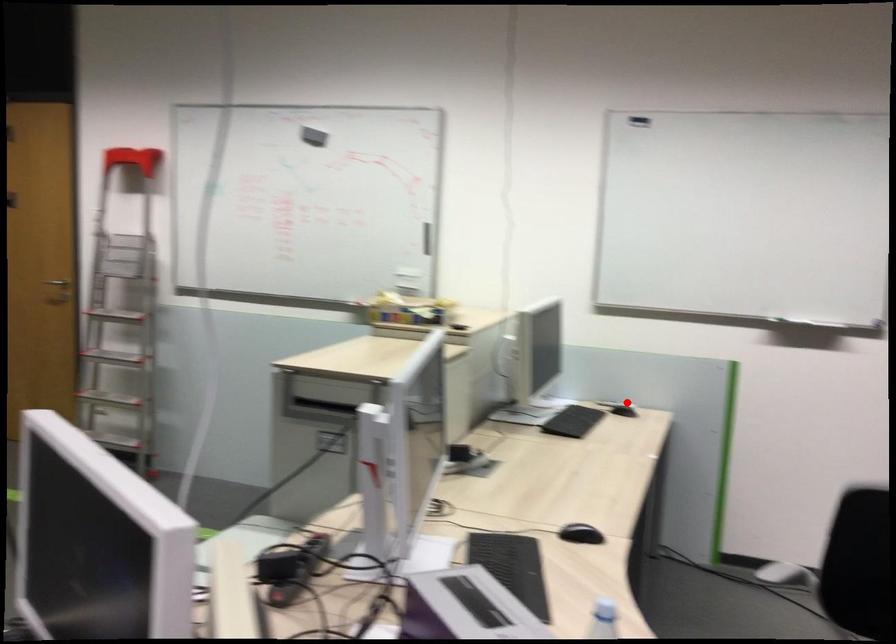
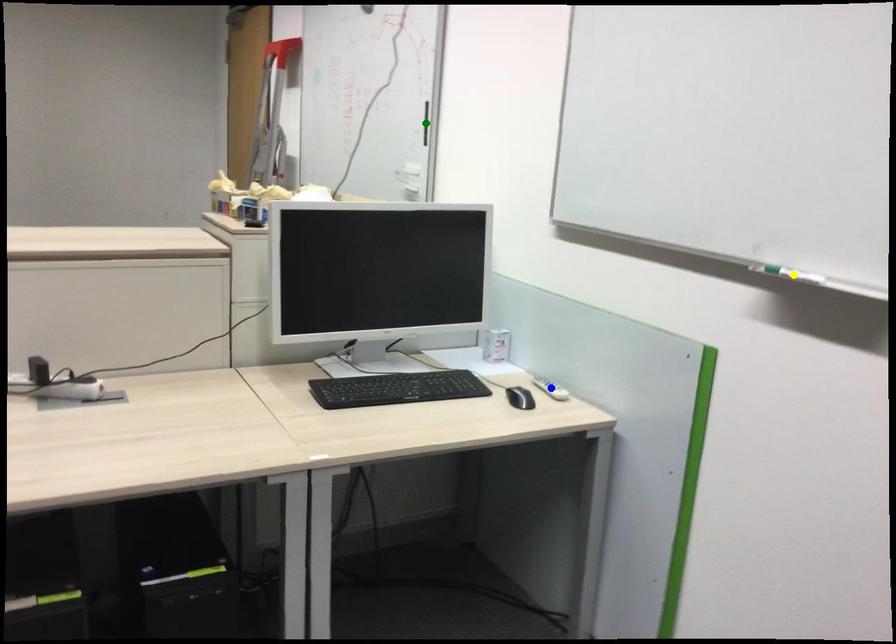
Question: I am providing you with two images of the same scene from different viewpoints. A red point is marked on the first image. You are given multiple points on the second image. Which point in image 2 is actually the same real-world point as the red point in image 1?

Choices:
 (A) blue point
 (B) yellow point
 (C) green point

Answer: (A)